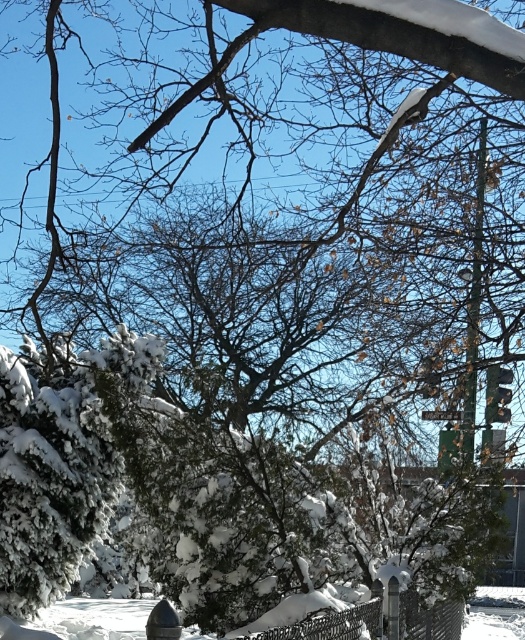
You are a painter setting up your easel to capture the winter scene. You want to include both the metallic wire fence at lower center and the shiny metallic hydrant at lower center in your painting. Which object should you position closer to the edge of your canvas to ensure both fit comfortably?

The metallic wire fence at lower center has a smaller width compared to the shiny metallic hydrant at lower center, so positioning the fence closer to the edge would allow both to fit comfortably in the painting.

You are standing in the winter scene and want to touch both the metallic wire fence at lower center and the shiny metallic hydrant at lower center. Which object will you reach first?

You will reach the metallic wire fence at lower center first because it is closer to you than the shiny metallic hydrant at lower center, which is further away.